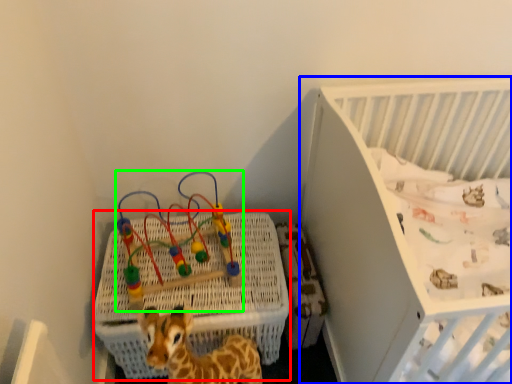
Question: Considering the real-world distances, which object is farthest from crate (highlighted by a red box)? infant bed (highlighted by a blue box) or toy (highlighted by a green box)?

Choices:
 (A) infant bed
 (B) toy

Answer: (A)